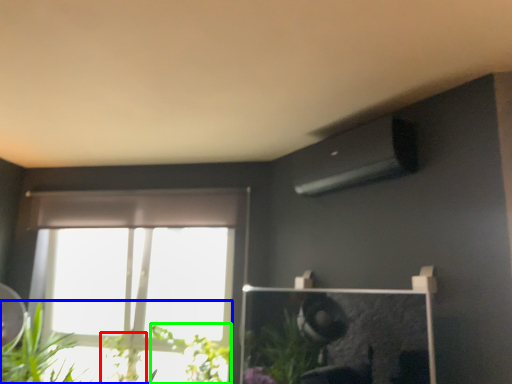
Question: Estimate the real-world distances between objects in this image. Which object is closer to plant (highlighted by a red box), houseplant (highlighted by a blue box) or plant (highlighted by a green box)?

Choices:
 (A) houseplant
 (B) plant

Answer: (B)